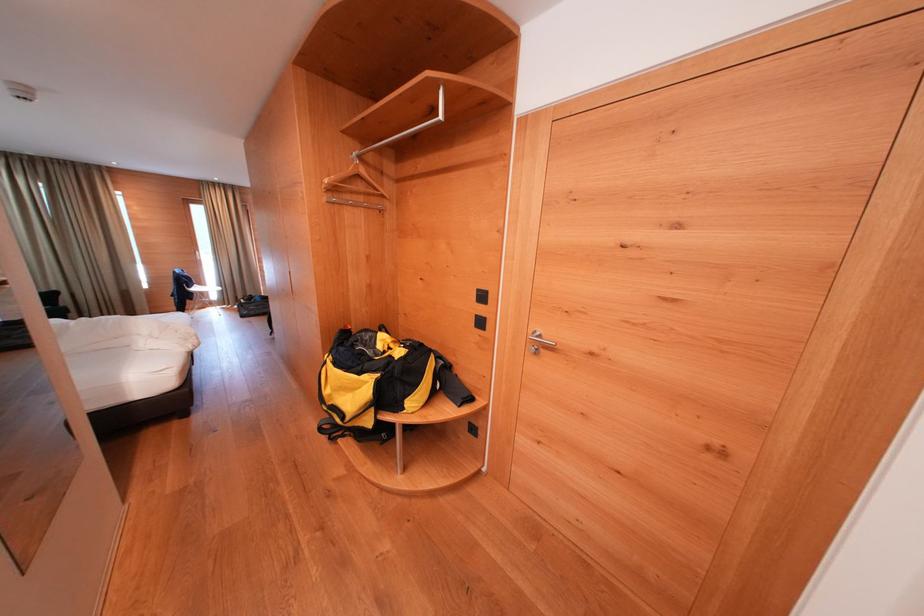
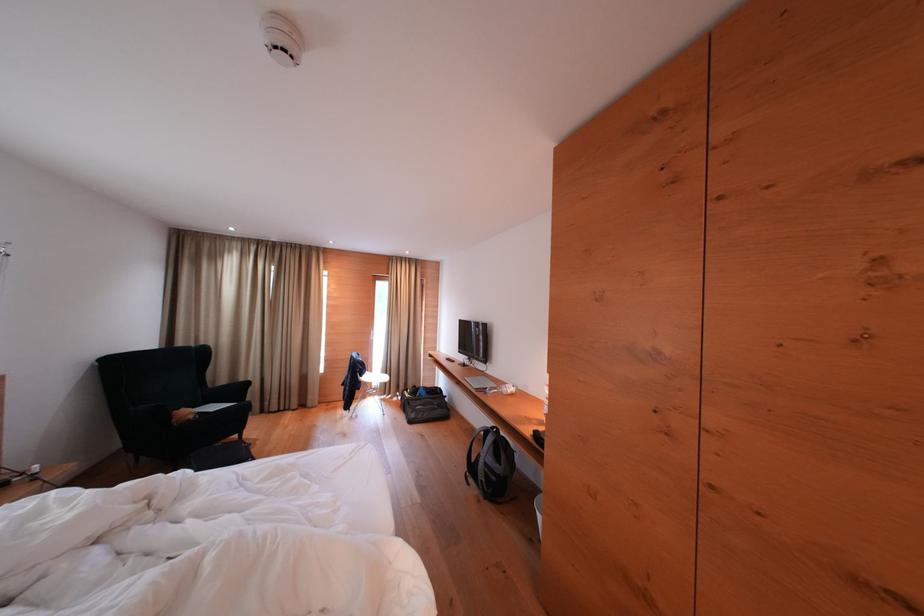
In the second image, find the point that corresponds to (x=215, y=293) in the first image.

(383, 379)